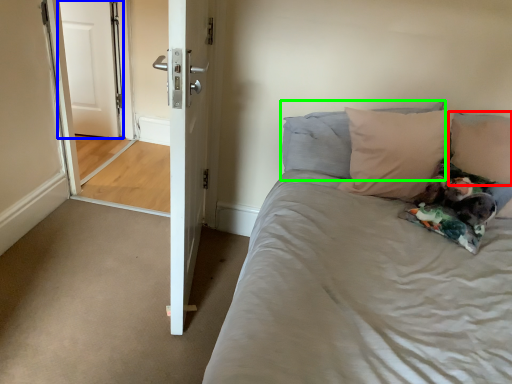
Question: Based on their relative distances, which object is farther from pillow (highlighted by a red box)? Choose from door (highlighted by a blue box) and pillow (highlighted by a green box).

Choices:
 (A) door
 (B) pillow

Answer: (A)